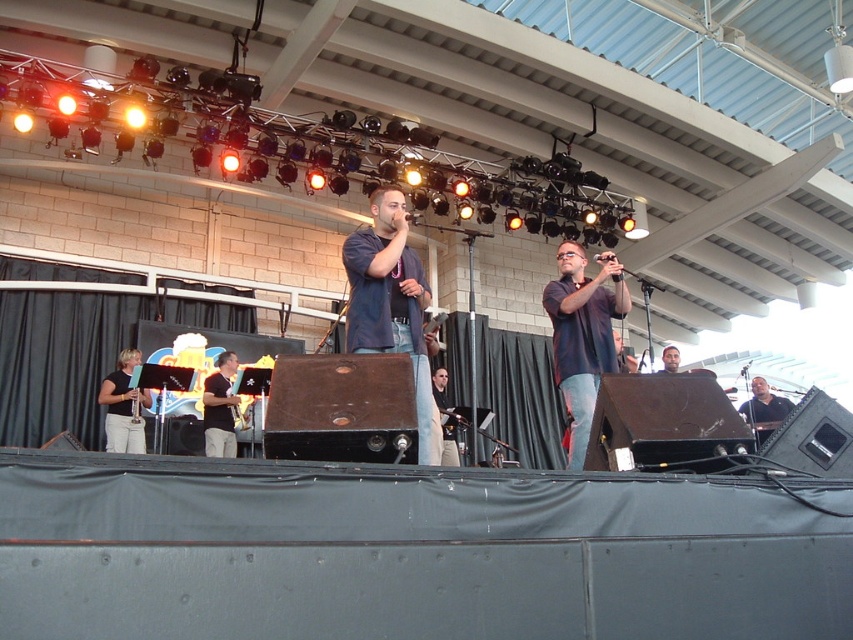
Question: Which of the following is the closest to the observer?

Choices:
 (A) [602, 260]
 (B) [438, 381]
 (C) [119, 388]
 (D) [747, 410]

Answer: (A)

Question: Based on their relative distances, which object is farther from the smooth skin face at center?

Choices:
 (A) light brown wood saxophone at center
 (B) black plastic microphone at center
 (C) matte blue shirt at center

Answer: (C)

Question: Which point is farther to the camera?

Choices:
 (A) (756, 422)
 (B) (111, 385)
 (C) (210, 394)

Answer: (A)

Question: Does matte black shirt at center lie in front of matte black clarinet at lower left?

Choices:
 (A) no
 (B) yes

Answer: (B)

Question: Is matte black clarinet at lower left positioned behind smooth skin face at center?

Choices:
 (A) no
 (B) yes

Answer: (A)

Question: Does black matte microphone at center appear on the right side of dark blue jeans at center?

Choices:
 (A) no
 (B) yes

Answer: (B)